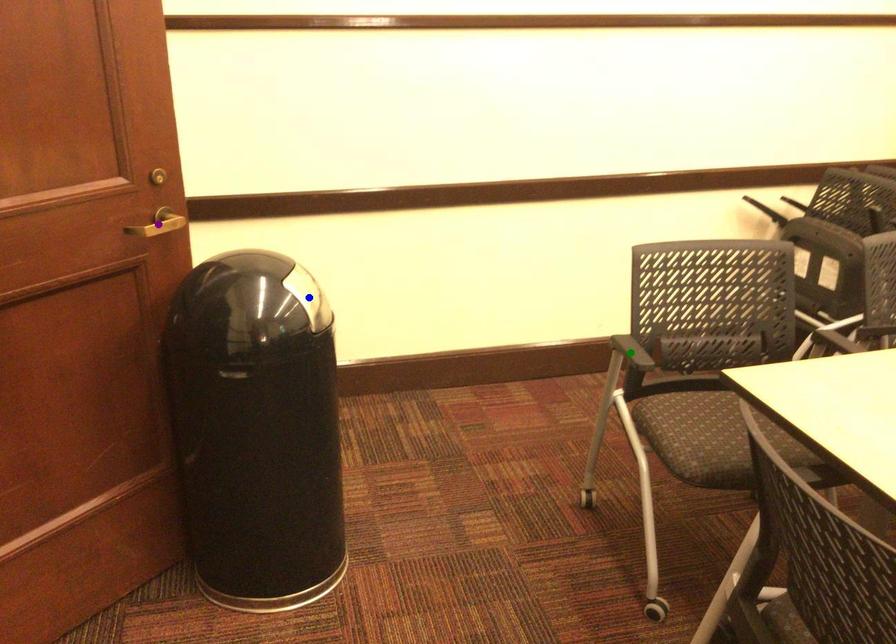
Order these from nearest to farthest:
green point
blue point
purple point

1. purple point
2. green point
3. blue point